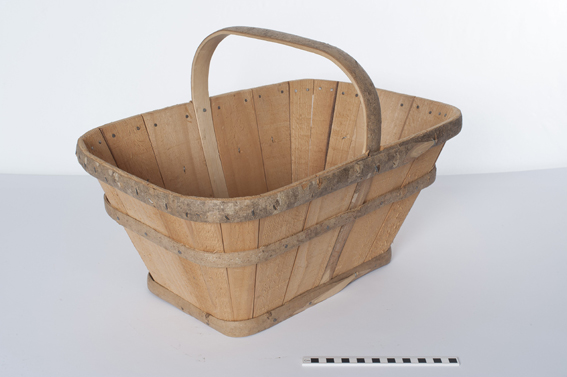
Identify the location of bucket. Image resolution: width=567 pixels, height=377 pixels. (198, 222).